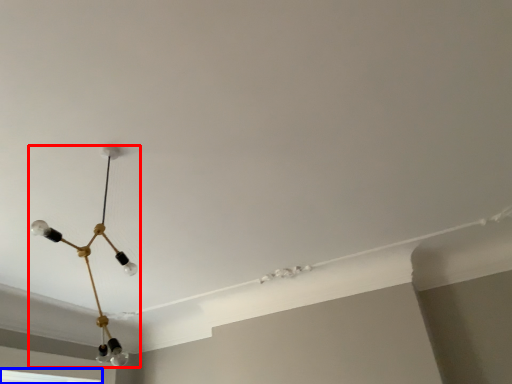
Question: Which object appears farthest to the camera in this image, lamp (highlighted by a red box) or window (highlighted by a blue box)?

Choices:
 (A) lamp
 (B) window

Answer: (B)